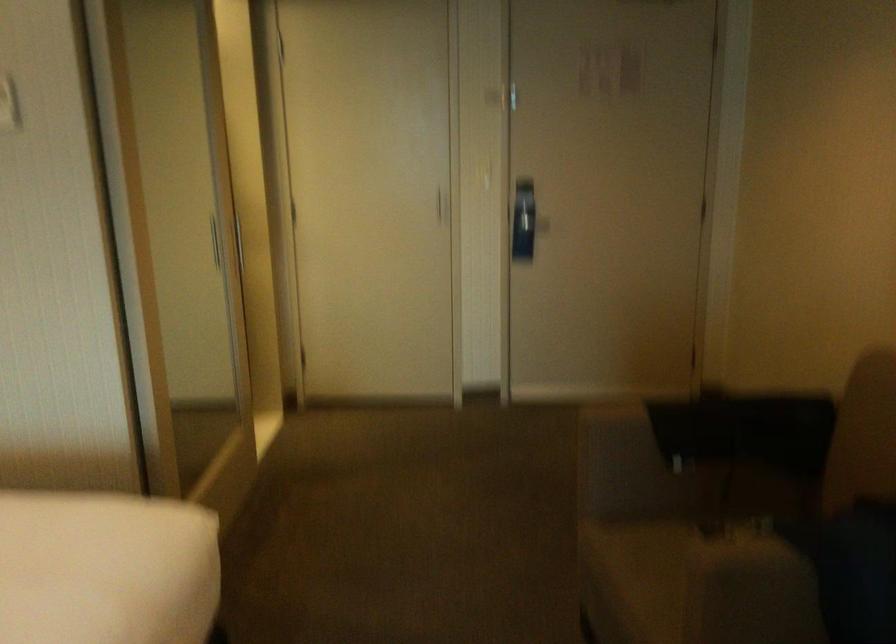
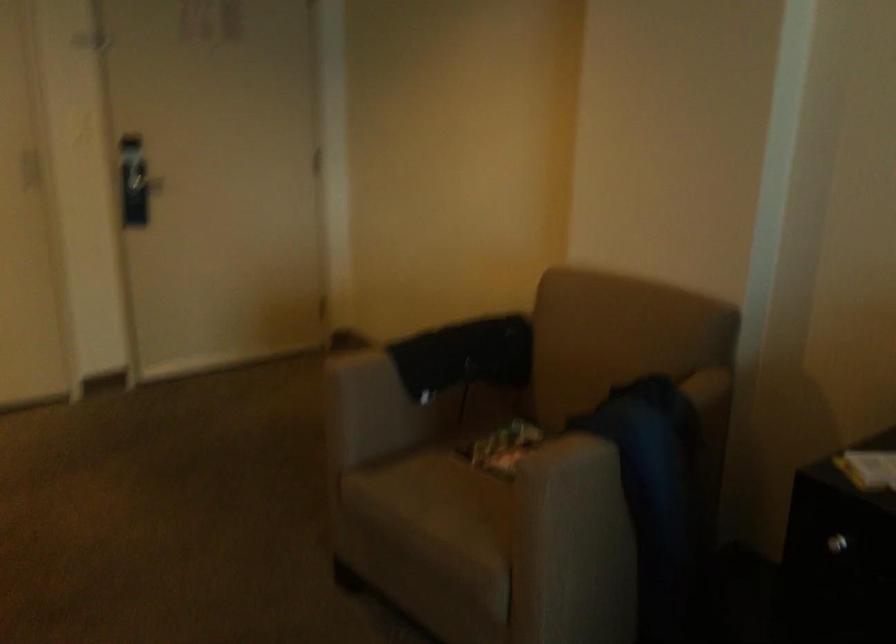
Where in the second image is the point corresponding to the point at 513,223 from the first image?

(135, 182)